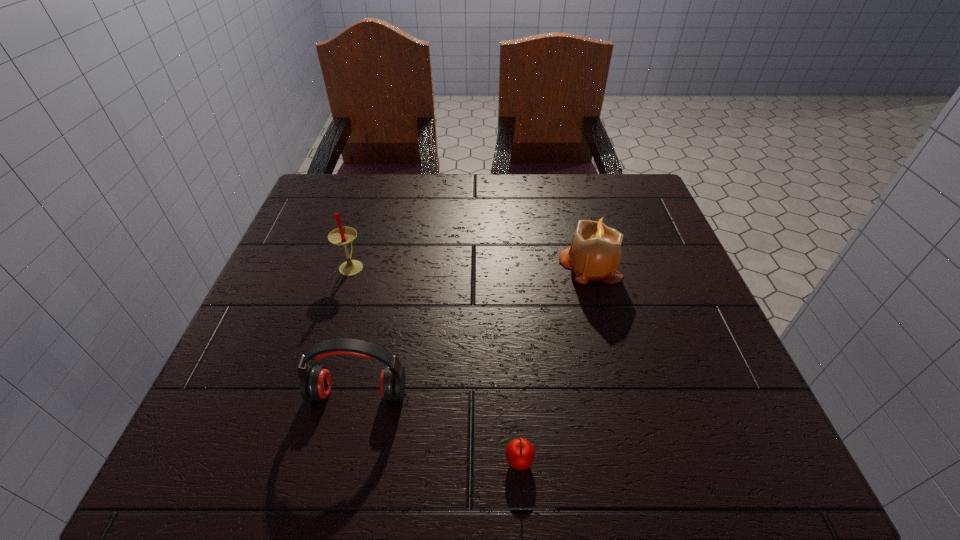
The image size is (960, 540). I want to click on object at the right edge, so click(x=594, y=255).

You are a GUI agent. You are given a task and a screenshot of the screen. Output one action in this format:
    pyautogui.click(x=<x>, y=<y>)
    Task: Click on the free spot at the far edge of the desktop
    Image resolution: width=960 pixels, height=540 pixels.
    Given the screenshot: What is the action you would take?
    pyautogui.click(x=455, y=220)

You are a GUI agent. You are given a task and a screenshot of the screen. Output one action in this format:
    pyautogui.click(x=<x>, y=<y>)
    Task: Click on the vacant space at the right edge of the desktop
    The width and height of the screenshot is (960, 540).
    Given the screenshot: What is the action you would take?
    pyautogui.click(x=728, y=357)

In the image, there is a desktop. At what (x,y) coordinates should I click in order to perform the action: click on free space at the far left corner. Please return your answer as a coordinate pair (x, y). Image resolution: width=960 pixels, height=540 pixels. Looking at the image, I should click on (328, 216).

This screenshot has width=960, height=540. In order to click on free space between the left candle and the third farthest object in this screenshot , I will do `click(355, 329)`.

Locate an element on the screen. free space between the earphone and the left candle is located at coordinates (355, 329).

Find the location of a particular element. The height and width of the screenshot is (540, 960). empty space between the earphone and the left candle is located at coordinates pyautogui.click(x=355, y=329).

Find the location of a particular element. This screenshot has height=540, width=960. vacant space in between the left candle and the shortest object is located at coordinates (434, 363).

The width and height of the screenshot is (960, 540). I want to click on empty space that is in between the nearest object and the left candle, so click(x=434, y=363).

Find the location of a particular element. vacant area that lies between the left candle and the nearest object is located at coordinates (434, 363).